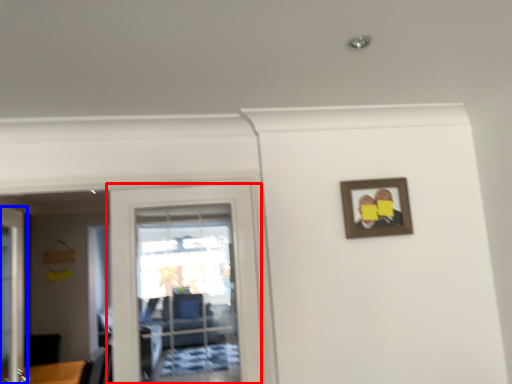
Question: Which of the following is the closest to the observer, door (highlighted by a red box) or door (highlighted by a blue box)?

Choices:
 (A) door
 (B) door

Answer: (A)